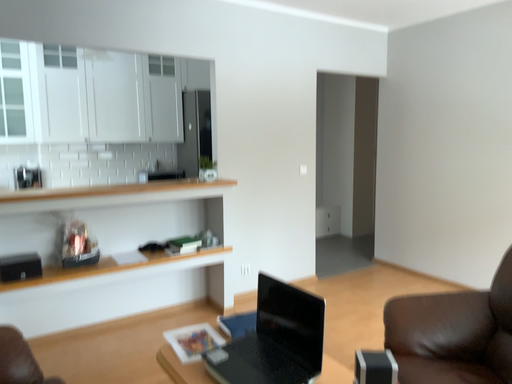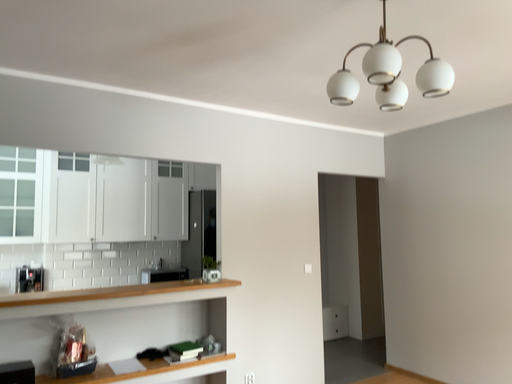
Question: How did the camera likely rotate when shooting the video?

Choices:
 (A) rotated upward
 (B) rotated downward

Answer: (A)